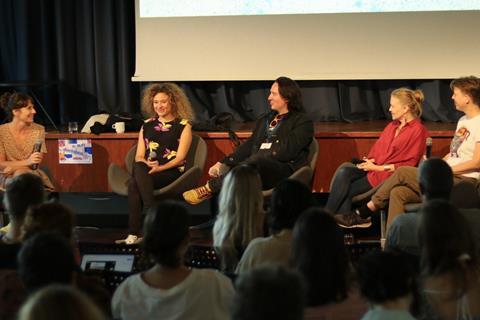
Where is `seat`? seat is located at coordinates (196, 157).